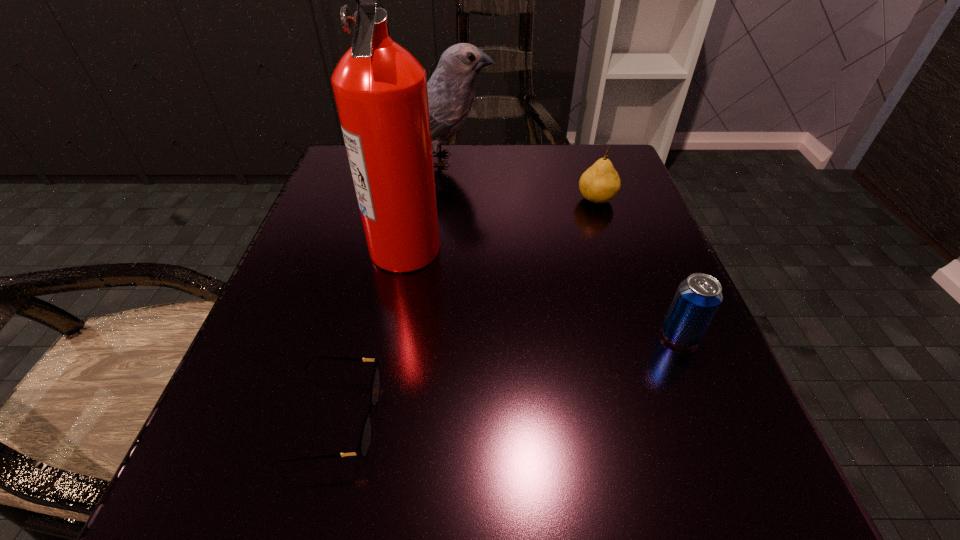
Locate an element on the screen. free space that satisfies the following two spatial constraints: 1. on the front-facing side of the parrot; 2. on the right side of the pear is located at coordinates (441, 199).

Locate an element on the screen. free space that satisfies the following two spatial constraints: 1. on the front-facing side of the parrot; 2. on the back side of the beer can is located at coordinates (425, 335).

Locate an element on the screen. free spot that satisfies the following two spatial constraints: 1. on the back side of the second nearest object; 2. at the nozzle of the fire extinguisher is located at coordinates (644, 248).

This screenshot has height=540, width=960. Find the location of `free spot that satisfies the following two spatial constraints: 1. on the back side of the beer can; 2. at the nozzle of the third nearest object`. free spot that satisfies the following two spatial constraints: 1. on the back side of the beer can; 2. at the nozzle of the third nearest object is located at coordinates (644, 248).